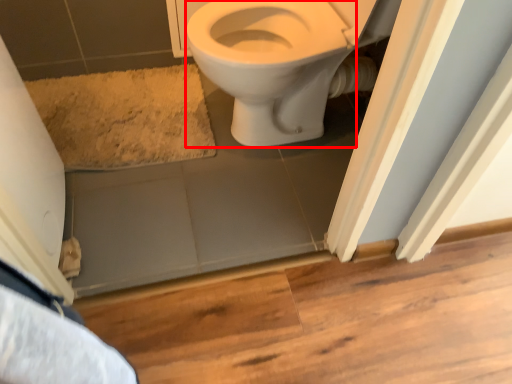
Question: From the image's perspective, where is bidet (annotated by the red box) located in relation to bath mat in the image?

Choices:
 (A) above
 (B) below

Answer: (A)